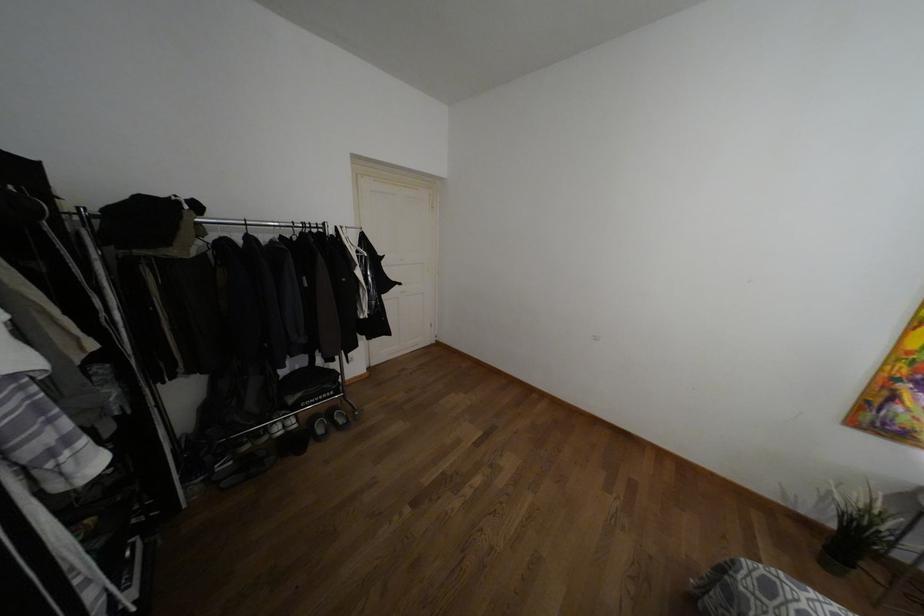
Where is `white sneaker`? This screenshot has height=616, width=924. white sneaker is located at coordinates (275, 429).